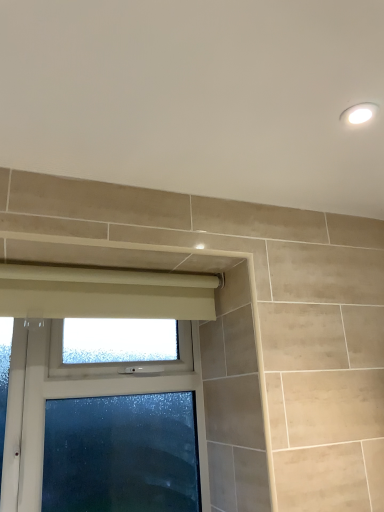
Question: Is the depth of white glossy light fixture at upper right greater than that of frosted glass window at lower left?

Choices:
 (A) yes
 (B) no

Answer: (B)

Question: Does white glossy light fixture at upper right appear on the left side of frosted glass window at lower left?

Choices:
 (A) yes
 (B) no

Answer: (B)

Question: Is white glossy light fixture at upper right positioned far away from frosted glass window at lower left?

Choices:
 (A) yes
 (B) no

Answer: (A)

Question: Considering the relative sizes of white glossy light fixture at upper right and frosted glass window at lower left in the image provided, is white glossy light fixture at upper right thinner than frosted glass window at lower left?

Choices:
 (A) no
 (B) yes

Answer: (B)

Question: Considering the relative sizes of white glossy light fixture at upper right and frosted glass window at lower left in the image provided, is white glossy light fixture at upper right bigger than frosted glass window at lower left?

Choices:
 (A) no
 (B) yes

Answer: (A)

Question: Is white glossy light fixture at upper right shorter than frosted glass window at lower left?

Choices:
 (A) yes
 (B) no

Answer: (A)

Question: From a real-world perspective, is frosted glass window at lower left physically below white glossy light fixture at upper right?

Choices:
 (A) yes
 (B) no

Answer: (A)

Question: Can you confirm if frosted glass window at lower left is thinner than white glossy light fixture at upper right?

Choices:
 (A) no
 (B) yes

Answer: (A)

Question: Is white glossy light fixture at upper right inside frosted glass window at lower left?

Choices:
 (A) yes
 (B) no

Answer: (B)

Question: Does frosted glass window at lower left lie in front of white glossy light fixture at upper right?

Choices:
 (A) no
 (B) yes

Answer: (A)

Question: Considering the relative sizes of frosted glass window at lower left and white glossy light fixture at upper right in the image provided, is frosted glass window at lower left smaller than white glossy light fixture at upper right?

Choices:
 (A) yes
 (B) no

Answer: (B)

Question: Is frosted glass window at lower left wider than white glossy light fixture at upper right?

Choices:
 (A) no
 (B) yes

Answer: (B)

Question: Is white glossy light fixture at upper right behind beige fabric curtain at upper center?

Choices:
 (A) yes
 (B) no

Answer: (B)